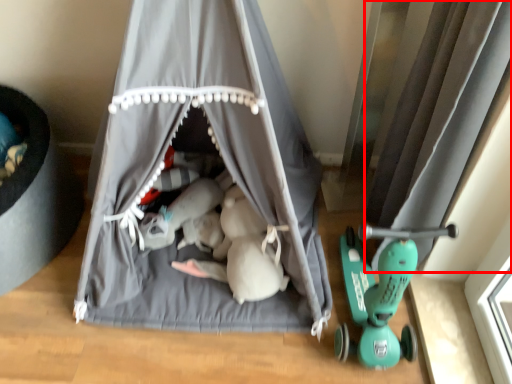
Question: From the image's perspective, what is the correct spatial relationship of curtain (annotated by the red box) in relation to curtain?

Choices:
 (A) below
 (B) above

Answer: (A)